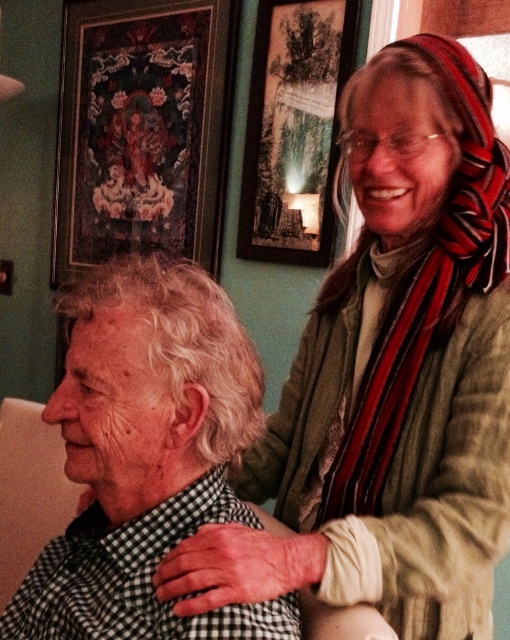
In the scene shown: Can you confirm if checkered fabric shirt at center is positioned above wooden framed picture at upper center?

Actually, checkered fabric shirt at center is below wooden framed picture at upper center.

Is checkered fabric shirt at center shorter than wooden framed picture at upper center?

Correct, checkered fabric shirt at center is not as tall as wooden framed picture at upper center.

Does point (97, 472) lie behind point (346, 10)?

No.

What are the coordinates of `checkered fabric shirt at center` in the screenshot? It's located at (146, 456).

Which of these two, wooden framed artwork at upper left or wooden framed picture at upper center, stands taller?

wooden framed artwork at upper left is taller.

Is point (94, 131) in front of point (310, 58)?

No, (94, 131) is behind (310, 58).

Which is behind, point (99, 196) or point (272, 65)?

Positioned behind is point (99, 196).

Where is `wooden framed artwork at upper left`? The image size is (510, 640). wooden framed artwork at upper left is located at coordinates (142, 129).

Which is in front, point (70, 385) or point (213, 104)?

Positioned in front is point (70, 385).

Where is `checkered fabric shirt at center`? This screenshot has width=510, height=640. checkered fabric shirt at center is located at coordinates (146, 456).

Find the location of a particular element. The width and height of the screenshot is (510, 640). checkered fabric shirt at center is located at coordinates (146, 456).